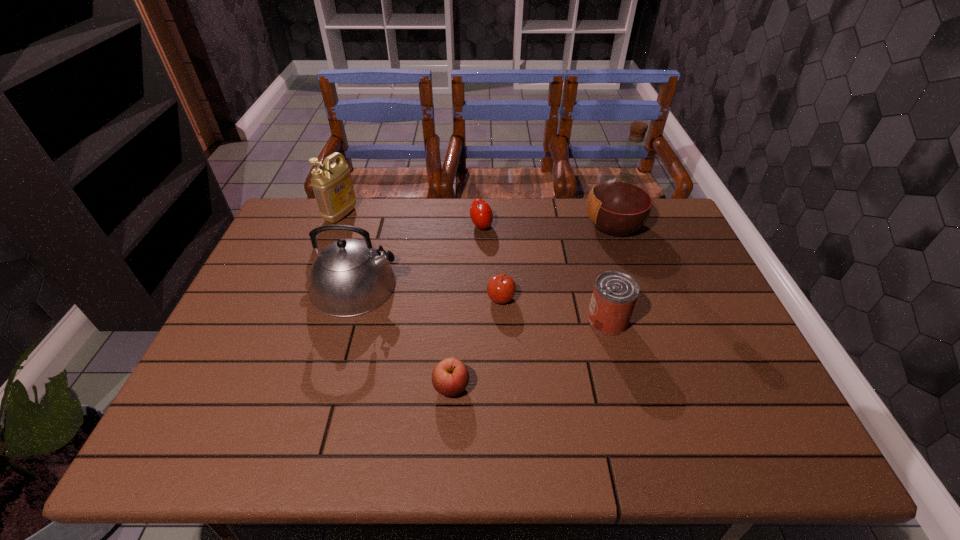
This screenshot has height=540, width=960. I want to click on object that is at the right edge, so click(x=618, y=205).

Find the location of a particular element. The width and height of the screenshot is (960, 540). object at the far left corner is located at coordinates (332, 184).

I want to click on object that is at the far right corner, so click(618, 205).

The height and width of the screenshot is (540, 960). I want to click on free point at the far edge, so click(519, 206).

Where is `vacant space at the near edge of the desktop`? The height and width of the screenshot is (540, 960). vacant space at the near edge of the desktop is located at coordinates (280, 444).

Locate an element on the screen. Image resolution: width=960 pixels, height=540 pixels. vacant space at the left edge of the desktop is located at coordinates (296, 268).

This screenshot has width=960, height=540. In the image, there is a desktop. Identify the location of vacant space at the right edge. (691, 265).

Where is `vacant space at the far left corner of the desktop`? The image size is (960, 540). vacant space at the far left corner of the desktop is located at coordinates 285,221.

I want to click on free space between the second farthest apple and the farthest apple, so click(492, 262).

Locate an element on the screen. free space between the kettle and the nearest object is located at coordinates (403, 336).